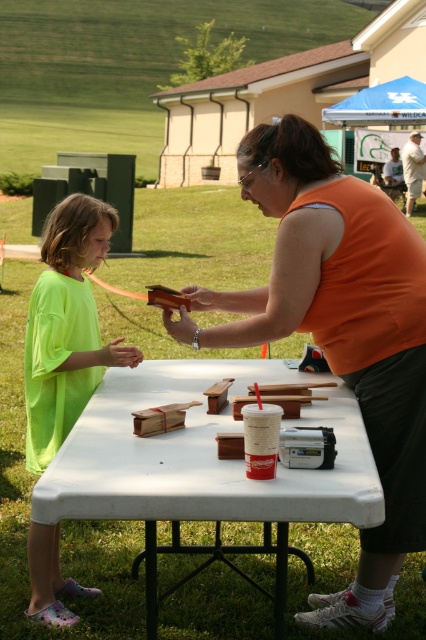
Is point (51, 515) less distant than point (36, 330)?

Yes, point (51, 515) is in front of point (36, 330).

Is white plastic table at center positioned in front of neon green t-shirt at left?

That is True.

Which is in front, point (180, 381) or point (49, 593)?

Point (49, 593) is more forward.

I want to click on white plastic table at center, so click(x=203, y=464).

Does orange fabric shirt at center have a lesser width compared to white plastic table at center?

Yes.

The image size is (426, 640). What do you see at coordinates (339, 330) in the screenshot?
I see `orange fabric shirt at center` at bounding box center [339, 330].

Does point (371, 401) lie behind point (207, 465)?

Yes, point (371, 401) is farther from viewer.

Where is `orange fabric shirt at center`? The image size is (426, 640). orange fabric shirt at center is located at coordinates (339, 330).

Describe the element at coordinates (339, 330) in the screenshot. Image resolution: width=426 pixels, height=640 pixels. I see `orange fabric shirt at center` at that location.

Based on the photo, does orange fabric shirt at center come in front of neon green t-shirt at left?

Yes.

I want to click on orange fabric shirt at center, so click(339, 330).